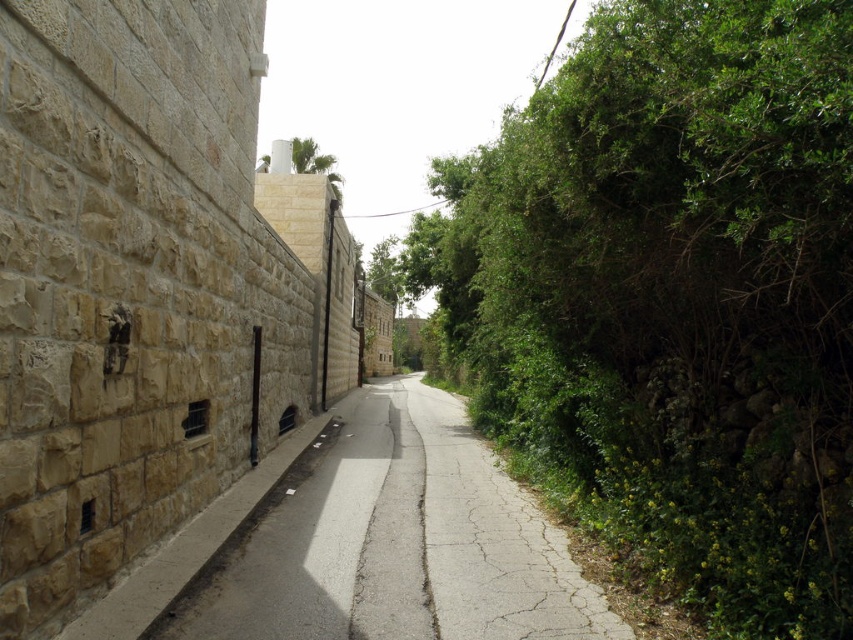
Is green leafy bush at right to the left of smooth concrete pavement at center from the viewer's perspective?

Incorrect, green leafy bush at right is not on the left side of smooth concrete pavement at center.

Which is in front, point (631, 435) or point (355, 637)?

Point (355, 637)

Describe the element at coordinates (672, 298) in the screenshot. This screenshot has width=853, height=640. I see `green leafy bush at right` at that location.

Locate an element on the screen. This screenshot has width=853, height=640. green leafy bush at right is located at coordinates (672, 298).

Who is more distant from viewer, (489, 260) or (339, 182)?

The point (339, 182) is more distant.

Can you confirm if green leafy bush at right is shorter than green leafy tree at upper center?

Yes.

Locate an element on the screen. The height and width of the screenshot is (640, 853). green leafy bush at right is located at coordinates (672, 298).

Locate an element on the screen. smooth concrete pavement at center is located at coordinates (369, 544).

Can you confirm if smooth concrete pavement at center is shorter than green leafy tree at upper center?

Yes.

This screenshot has width=853, height=640. What are the coordinates of `smooth concrete pavement at center` in the screenshot? It's located at (369, 544).